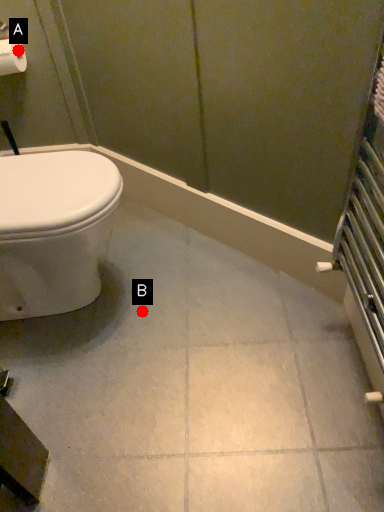
Question: Two points are circled on the image, labeled by A and B beside each circle. Which point is closer to the camera?

Choices:
 (A) A is closer
 (B) B is closer

Answer: (B)